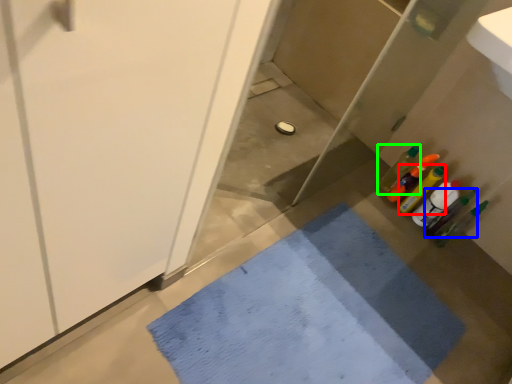
Question: Based on their relative distances, which object is nearer to bottle (highlighted by a red box)? Choose from bottle (highlighted by a blue box) and bottle (highlighted by a green box).

Choices:
 (A) bottle
 (B) bottle

Answer: (B)